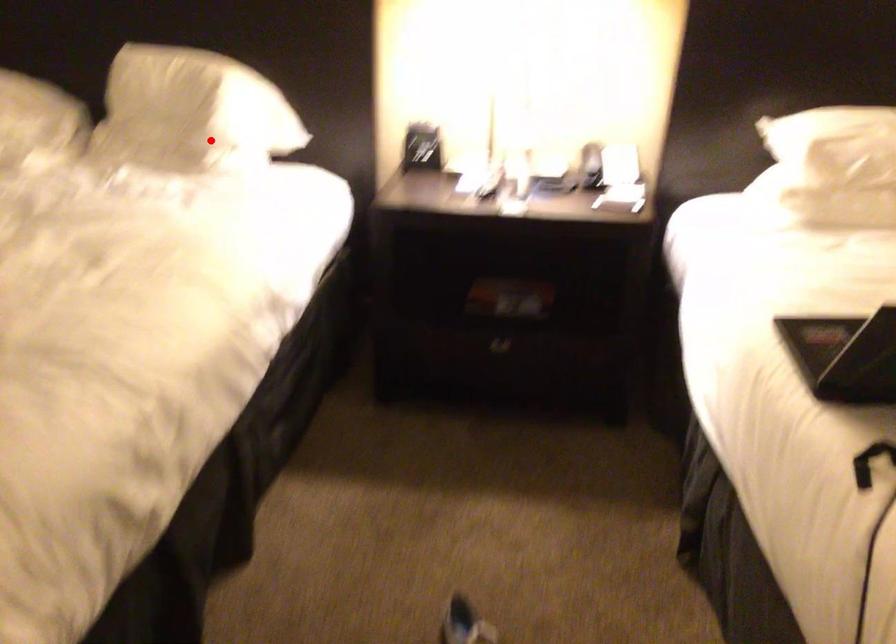
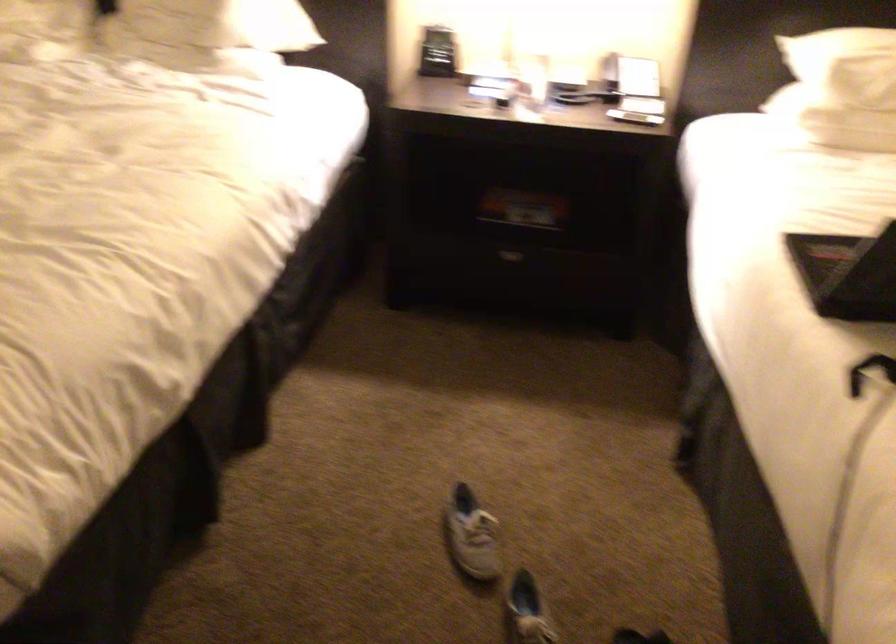
Question: I am providing you with two images of the same scene from different viewpoints. A red point is marked on the first image. Can you still see the location of the red point in image 2?

Choices:
 (A) Yes
 (B) No

Answer: (A)